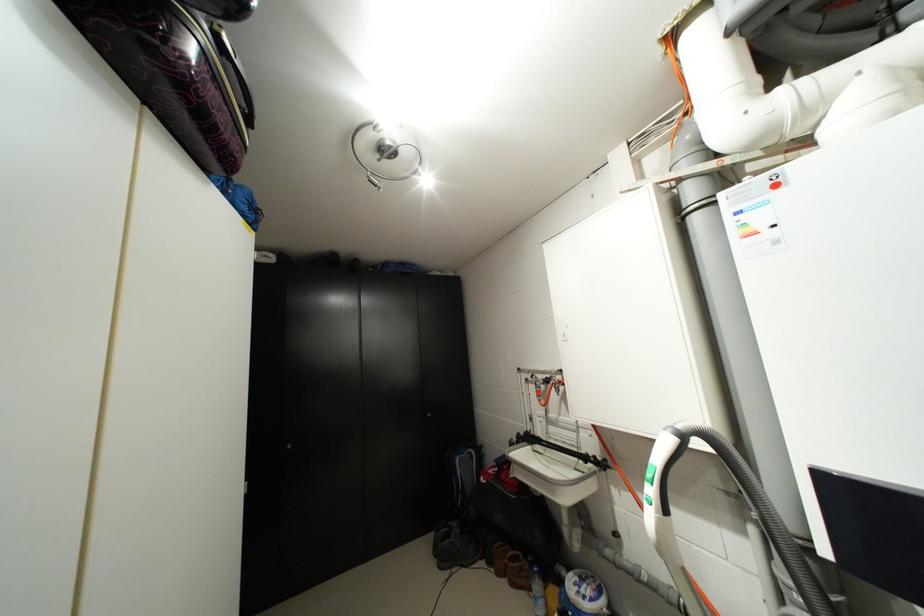
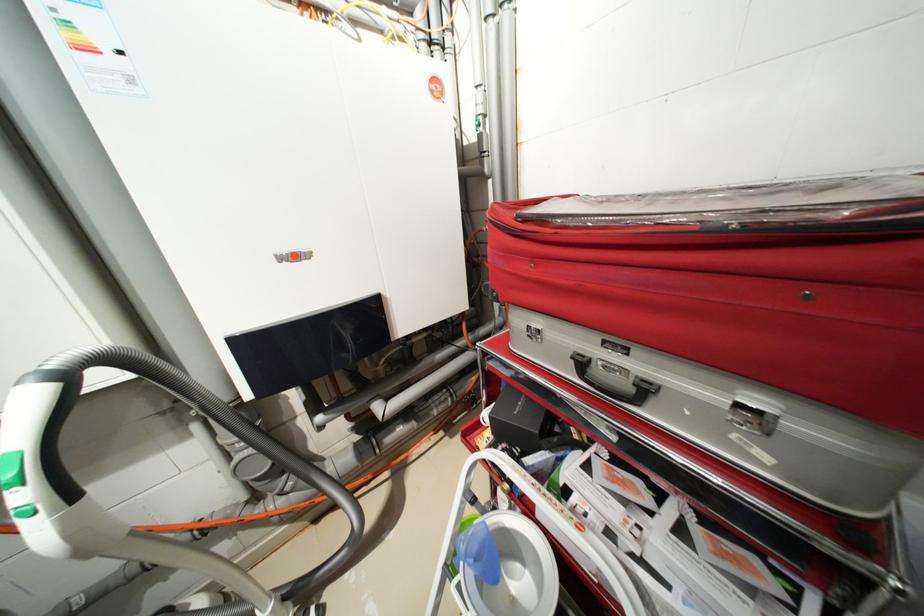
Find the pixel in the second image that matches the point at 676,431 in the first image.

(40, 379)